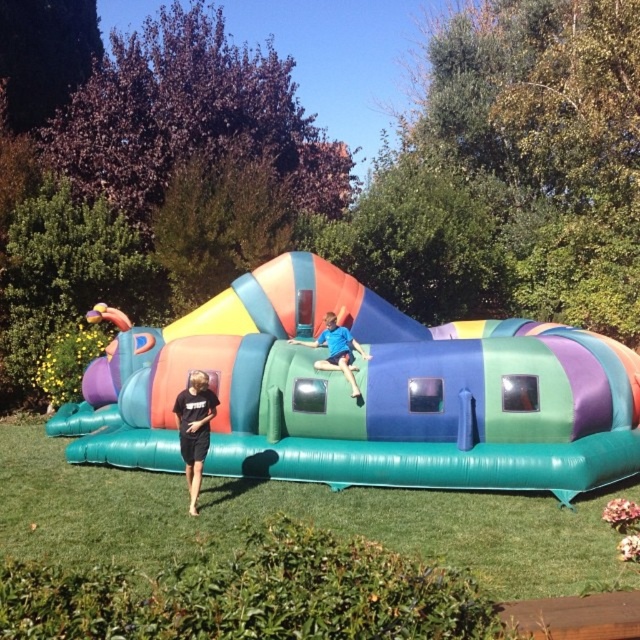
Question: Which point is farther from the camera taking this photo?

Choices:
 (A) (x=192, y=445)
 (B) (x=353, y=324)

Answer: (B)

Question: Does multicolored inflatable at center have a larger size compared to black matte t-shirt at lower left?

Choices:
 (A) yes
 (B) no

Answer: (B)

Question: Which of these objects is positioned farthest from the multicolored inflatable at center?

Choices:
 (A) black matte t-shirt at lower left
 (B) blue matte shirt at center

Answer: (A)

Question: Which point is farther to the camera?

Choices:
 (A) multicolored inflatable at center
 (B) blue matte shirt at center

Answer: (A)

Question: Is multicolored inflatable at center closer to camera compared to black matte t-shirt at lower left?

Choices:
 (A) no
 (B) yes

Answer: (A)

Question: Is multicolored inflatable at center positioned before blue matte shirt at center?

Choices:
 (A) no
 (B) yes

Answer: (A)